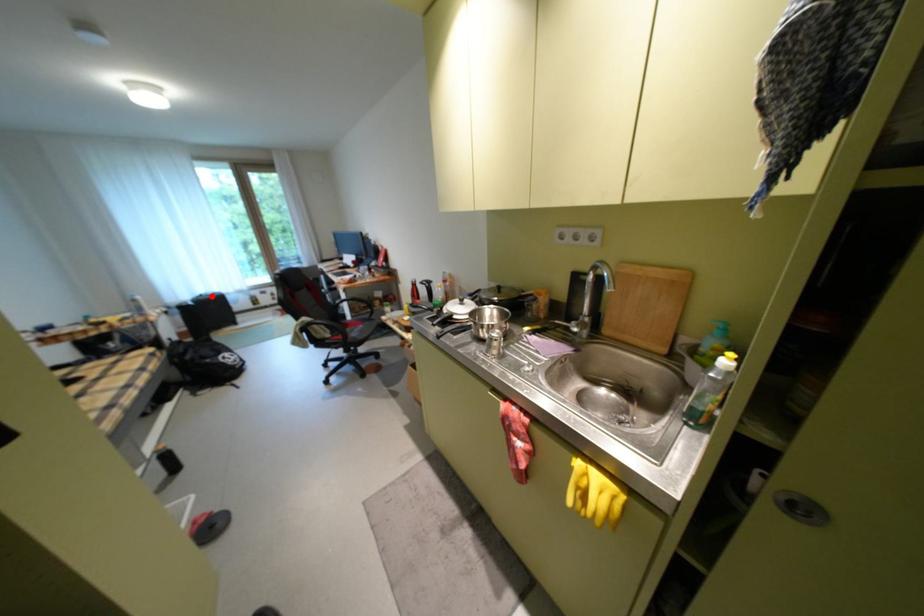
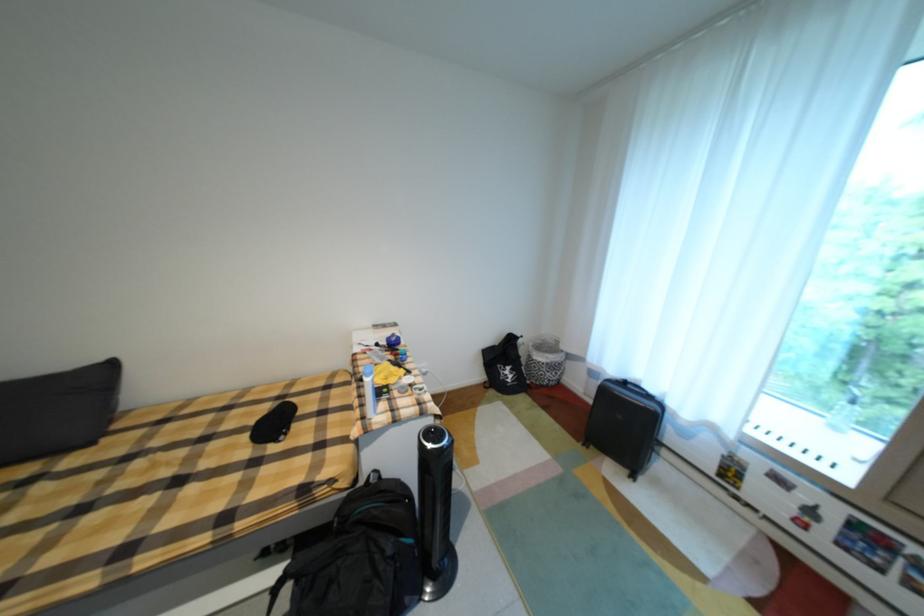
Where in the second image is the point corresponding to the highlighted location from the first image?

(635, 384)